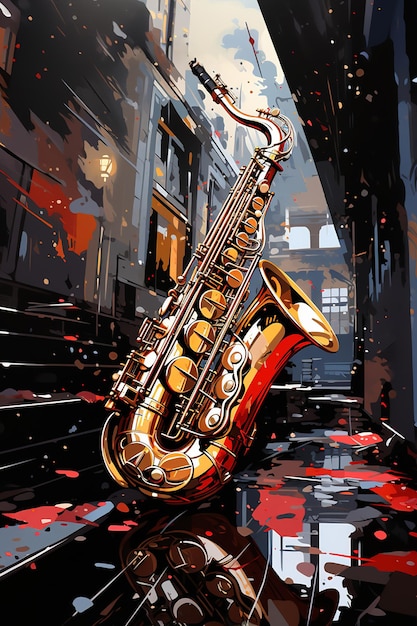
Find the location of a particular element. This screenshot has width=417, height=626. large window without paneling is located at coordinates (328, 239), (298, 237).